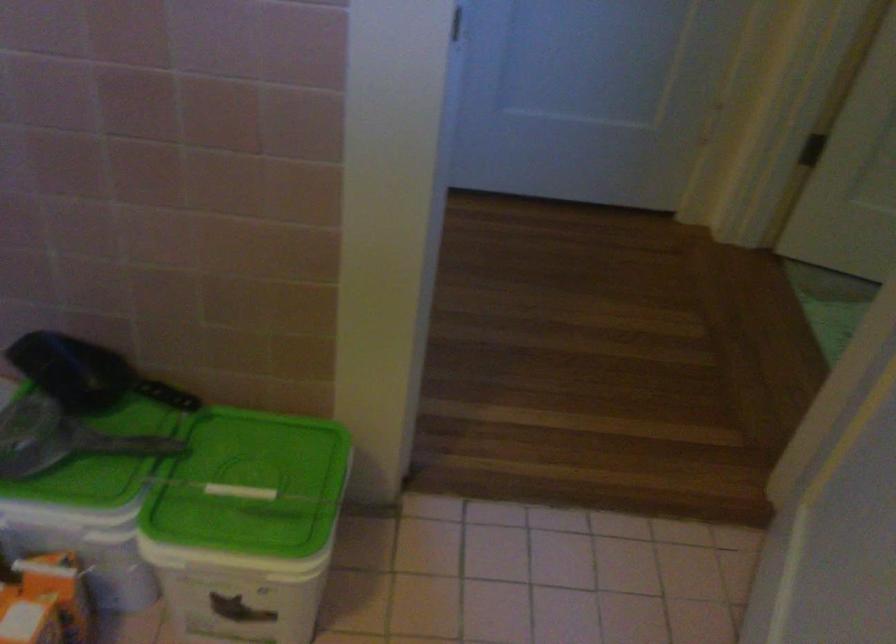
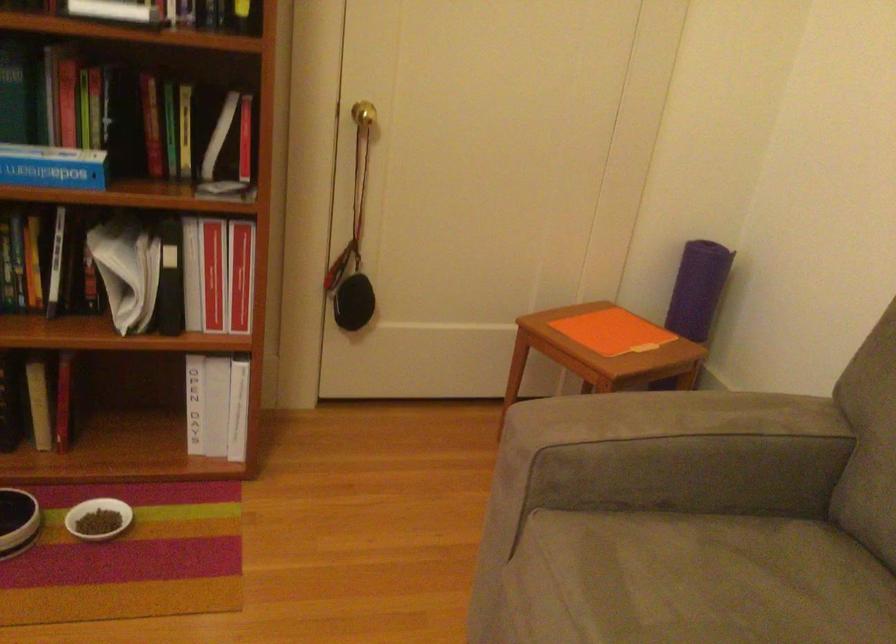
Question: I am providing you with two images of the same scene from different viewpoints. After the viewpoint changes to image2, which objects are now occluded?

Choices:
 (A) green plastic lid
 (B) sofa armrest
 (C) red binder
 (D) red label bottle

Answer: (A)